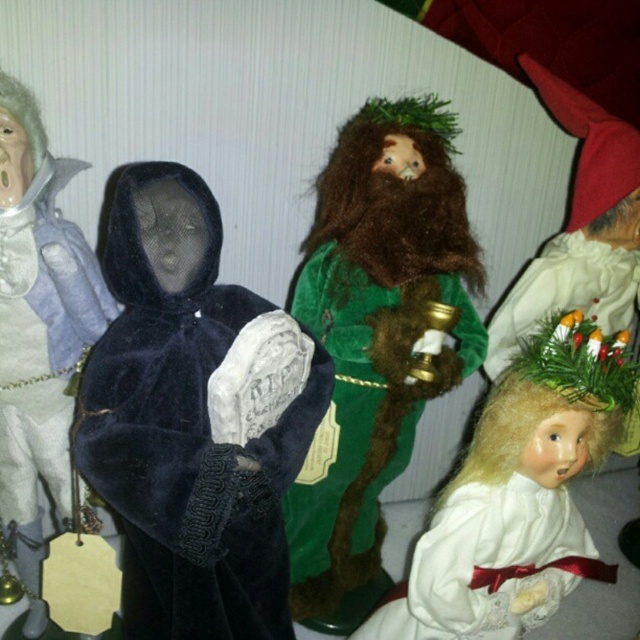
You are a collector who wants to place a new figurine between the velvet black cloak at left and the white satin dress at lower right. The new figurine is 10 inches wide. Is there enough space between them to fit it?

→ The distance between the velvet black cloak at left and the white satin dress at lower right is 22.30 inches. Since the new figurine is 10 inches wide, there is sufficient space to place it between them.

You are organizing a display and want to place the velvet black cloak at left and the white satin dress at lower right side by side. Which of the two requires more horizontal space due to its width?

The white satin dress at lower right requires more horizontal space because its width is greater than the velvet black cloak at left.

You are an interior designer arranging these figurines on a shelf. You want to ensure that the velvet black cape at center is visible from above the green velvet figure at center. Is the current arrangement suitable for this requirement?

The velvet black cape at center is below the green velvet figure at center, so it is not visible from above. To make it visible, the velvet black cape at center should be placed above the green velvet figure at center.